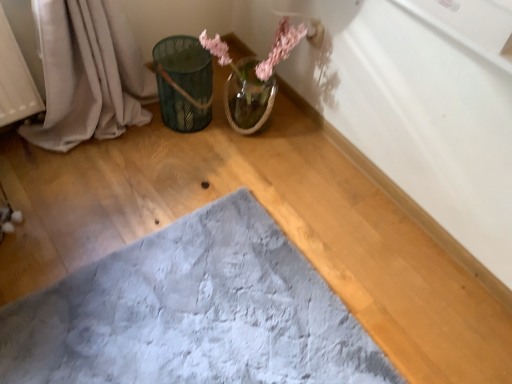
Question: Considering their positions, is green metallic bucket at upper left located in front of or behind soft gray plush bath mat at center?

Choices:
 (A) front
 (B) behind

Answer: (B)

Question: From the image's perspective, is green metallic bucket at upper left positioned above or below soft gray plush bath mat at center?

Choices:
 (A) above
 (B) below

Answer: (A)

Question: Which object is positioned closest to the soft gray plush bath mat at center?

Choices:
 (A) green metallic bucket at upper left
 (B) translucent glass vase at upper center

Answer: (A)

Question: Estimate the real-world distances between objects in this image. Which object is farther from the soft gray plush bath mat at center?

Choices:
 (A) translucent glass vase at upper center
 (B) green metallic bucket at upper left

Answer: (A)